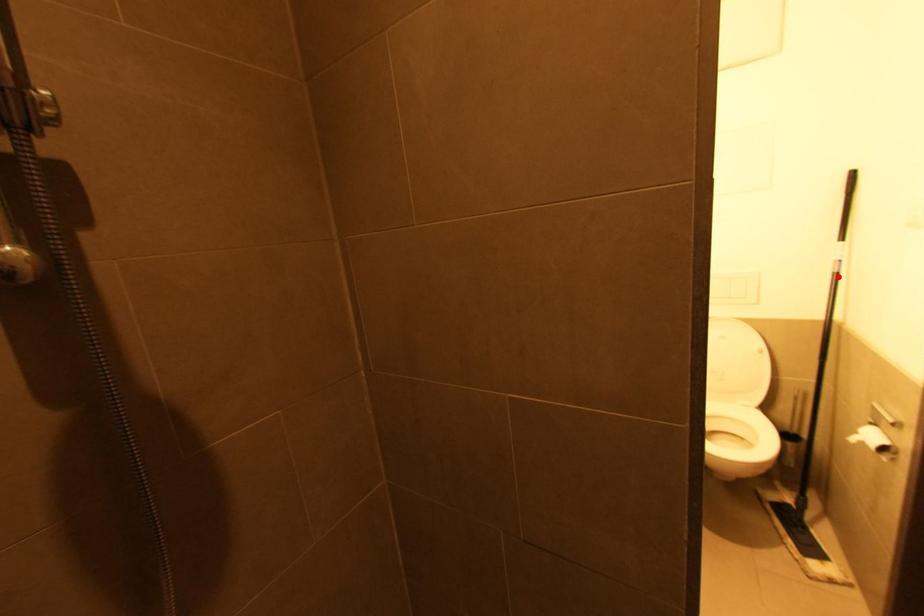
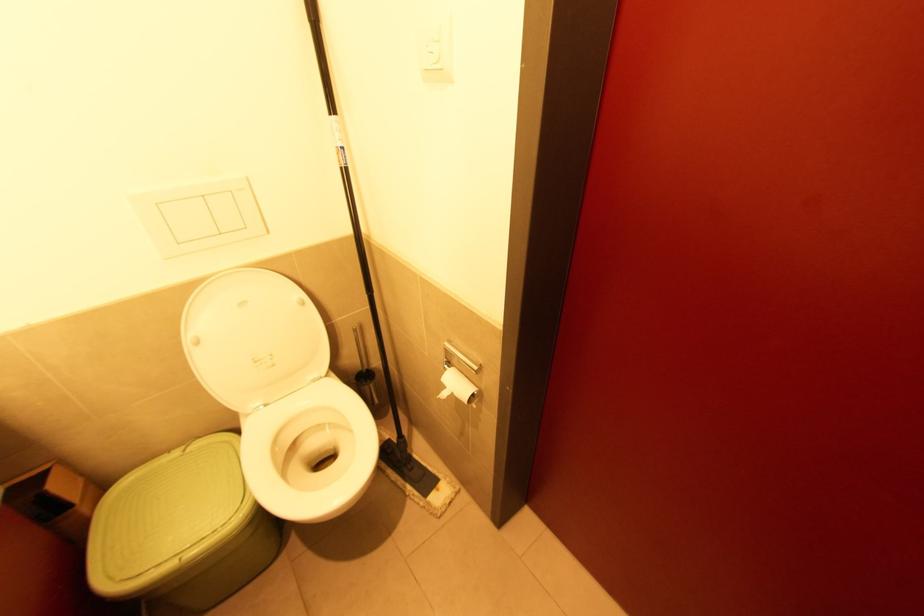
Locate, in the second image, the point that corresponds to the highlighted location in the first image.

(347, 172)